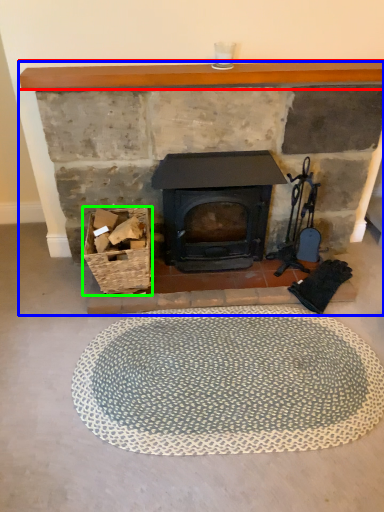
Question: Which is nearer to the balustrade (highlighted by a red box)? fireplace (highlighted by a blue box) or basket (highlighted by a green box).

Choices:
 (A) fireplace
 (B) basket

Answer: (A)